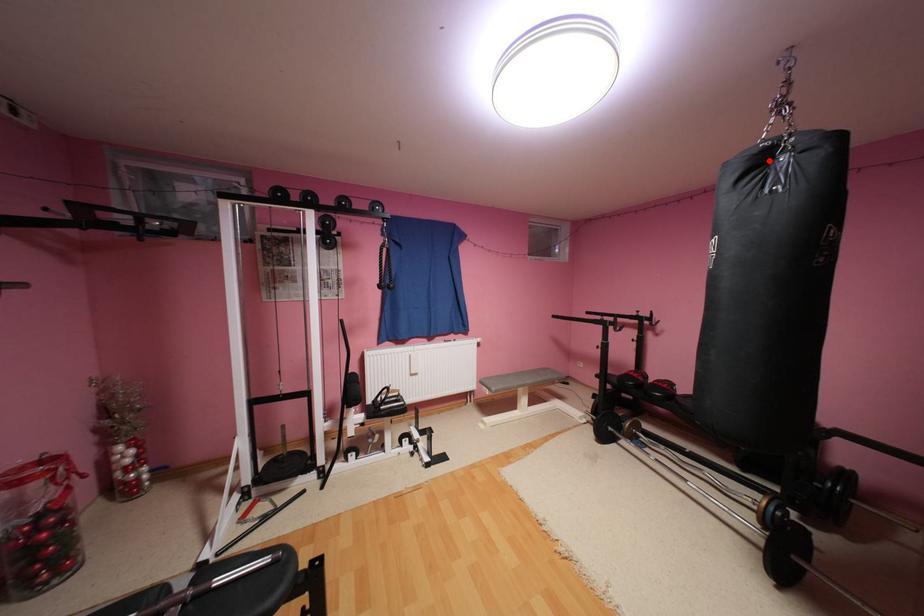
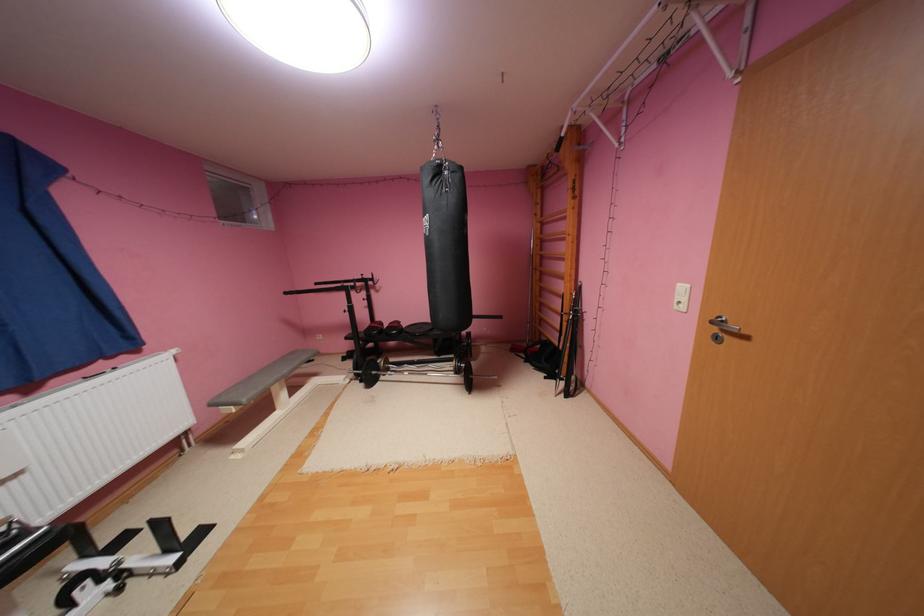
Find the pixel in the second image that matches the highlighted location in the first image.

(446, 171)